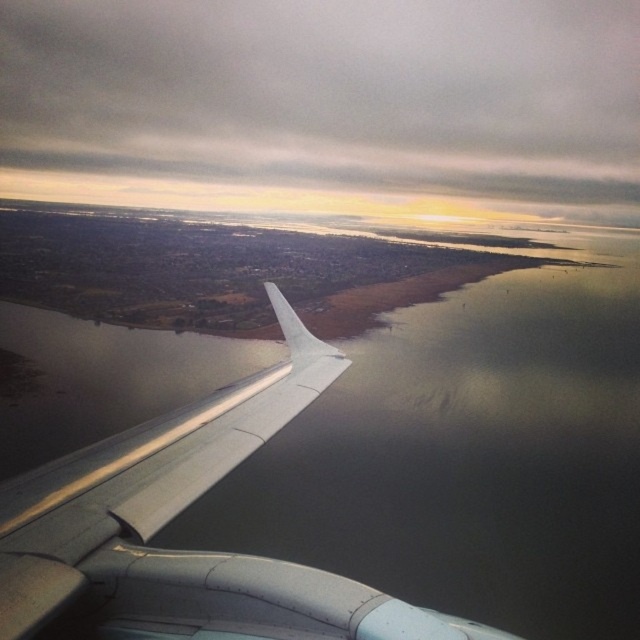
Question: Which object appears closest to the camera in this image?

Choices:
 (A) gray matte cloud at upper center
 (B) metallic gray wing at lower left

Answer: (B)

Question: Does gray matte cloud at upper center have a greater width compared to metallic gray wing at lower left?

Choices:
 (A) no
 (B) yes

Answer: (B)

Question: Can you confirm if gray matte cloud at upper center is smaller than metallic gray wing at lower left?

Choices:
 (A) yes
 (B) no

Answer: (B)

Question: Is gray matte cloud at upper center above metallic gray wing at lower left?

Choices:
 (A) no
 (B) yes

Answer: (B)

Question: Which point is farther from the camera taking this photo?

Choices:
 (A) (26, 513)
 (B) (35, 186)

Answer: (B)